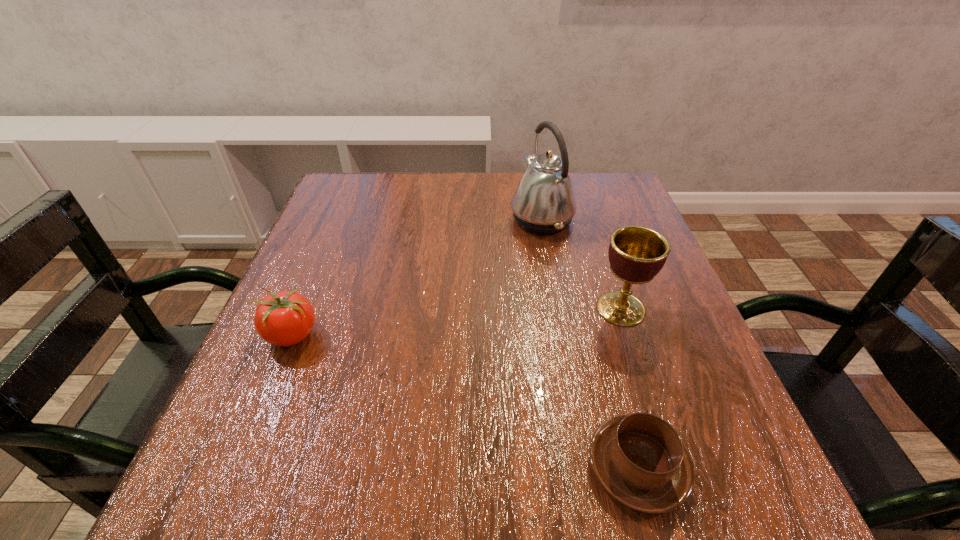
Find the location of a particular element. The width and height of the screenshot is (960, 540). free spot between the chalice and the shortest object is located at coordinates (629, 388).

Locate an element on the screen. Image resolution: width=960 pixels, height=540 pixels. blank region between the nearest object and the kettle is located at coordinates (589, 343).

Where is `free space between the nearest object and the kettle`? This screenshot has width=960, height=540. free space between the nearest object and the kettle is located at coordinates (589, 343).

This screenshot has width=960, height=540. What are the coordinates of `empty space between the farthest object and the nearest object` in the screenshot? It's located at (589, 343).

Image resolution: width=960 pixels, height=540 pixels. In order to click on empty space that is in between the leftmost object and the chalice in this screenshot , I will do `click(456, 322)`.

The image size is (960, 540). Identify the location of free spot between the kettle and the shortest object. (589, 343).

Identify which object is the nearest to the tallest object. Please provide its 2D coordinates. Your answer should be formatted as a tuple, i.e. [(x, y)], where the tuple contains the x and y coordinates of a point satisfying the conditions above.

[(636, 254)]

Where is `object that can be found as the closest to the farthest object`? This screenshot has width=960, height=540. object that can be found as the closest to the farthest object is located at coordinates (636, 254).

I want to click on free space that satisfies the following two spatial constraints: 1. on the front side of the second tallest object; 2. on the left side of the kettle, so click(x=558, y=309).

I want to click on free space that satisfies the following two spatial constraints: 1. on the side of the cappuccino with the handle; 2. on the right side of the second tallest object, so click(x=595, y=309).